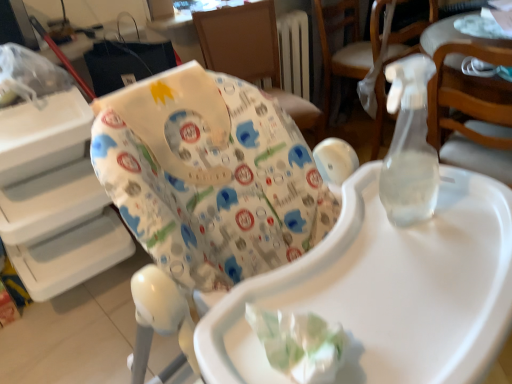
Question: Can you confirm if white glossy table at upper right is positioned to the left of wooden chair at upper right, placed as the second chair when sorted from left to right?

Choices:
 (A) yes
 (B) no

Answer: (B)

Question: Is the position of white glossy table at upper right more distant than that of wooden chair at upper right, placed as the second chair when sorted from left to right?

Choices:
 (A) yes
 (B) no

Answer: (B)

Question: Is white glossy table at upper right completely or partially outside of wooden chair at upper right, placed as the second chair when sorted from left to right?

Choices:
 (A) yes
 (B) no

Answer: (A)

Question: Is white glossy table at upper right turned away from wooden chair at upper right, placed as the second chair when sorted from left to right?

Choices:
 (A) no
 (B) yes

Answer: (A)

Question: Considering the relative positions of white glossy table at upper right and wooden chair at upper right, arranged as the 1th chair when viewed from the right, in the image provided, is white glossy table at upper right to the right of wooden chair at upper right, arranged as the 1th chair when viewed from the right, from the viewer's perspective?

Choices:
 (A) yes
 (B) no

Answer: (A)

Question: From the image's perspective, is white glossy table at upper right over wooden chair at upper right, placed as the second chair when sorted from left to right?

Choices:
 (A) yes
 (B) no

Answer: (B)

Question: Is white fabric baby seat at upper center touching white glossy table at upper right?

Choices:
 (A) no
 (B) yes

Answer: (A)

Question: From the image's perspective, is white fabric baby seat at upper center on top of white glossy table at upper right?

Choices:
 (A) no
 (B) yes

Answer: (A)

Question: Can you confirm if white fabric baby seat at upper center is smaller than white glossy table at upper right?

Choices:
 (A) yes
 (B) no

Answer: (B)

Question: Is white glossy table at upper right at the back of white fabric baby seat at upper center?

Choices:
 (A) yes
 (B) no

Answer: (B)

Question: From a real-world perspective, is white fabric baby seat at upper center under white glossy table at upper right?

Choices:
 (A) yes
 (B) no

Answer: (A)

Question: Does white fabric baby seat at upper center come in front of white glossy table at upper right?

Choices:
 (A) yes
 (B) no

Answer: (A)

Question: Is white fabric highchair at center, which is the first chair in left-to-right order, bigger than white fabric baby seat at upper center?

Choices:
 (A) yes
 (B) no

Answer: (B)